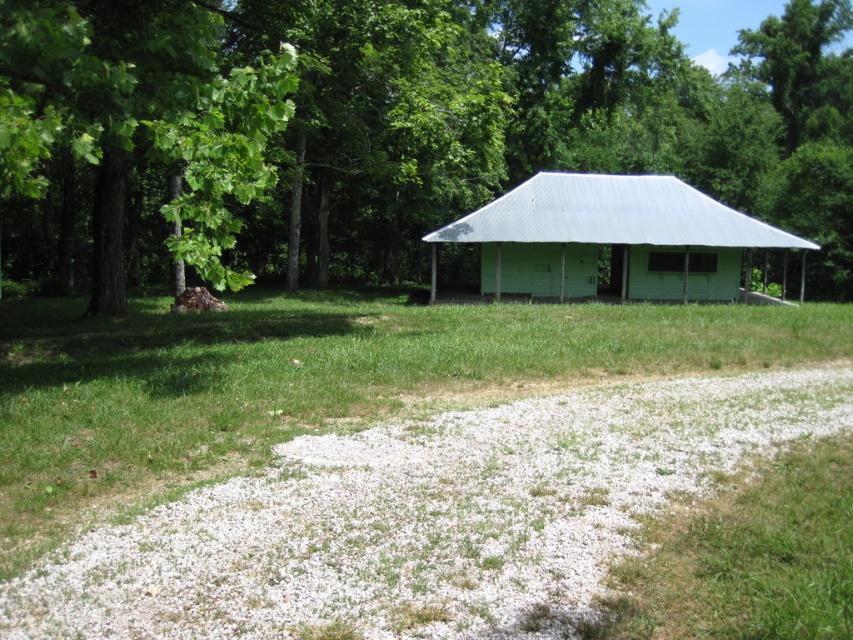
Question: Is green leafy tree at upper left behind green matte/light wood hut at center?

Choices:
 (A) yes
 (B) no

Answer: (B)

Question: Which point is farther to the camera?

Choices:
 (A) green leafy tree at upper left
 (B) green grass at center

Answer: (A)

Question: Which object appears farthest from the camera in this image?

Choices:
 (A) green matte/light wood hut at center
 (B) green grass at center

Answer: (A)

Question: Can you confirm if green leafy tree at upper left is positioned above green grass at center?

Choices:
 (A) no
 (B) yes

Answer: (B)

Question: Can you confirm if green grass at center is thinner than green matte/light wood hut at center?

Choices:
 (A) yes
 (B) no

Answer: (B)

Question: Among these objects, which one is farthest from the camera?

Choices:
 (A) green matte/light wood hut at center
 (B) green grass at center

Answer: (A)